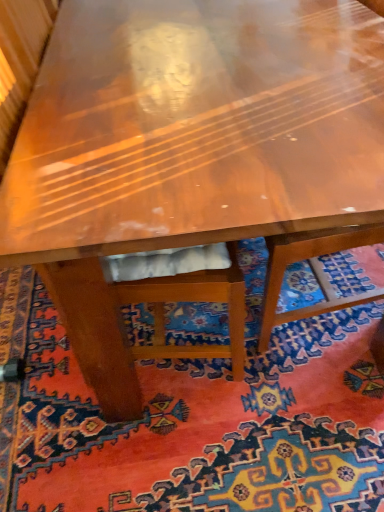
Locate an element on the screen. This screenshot has height=512, width=384. carpet with intricate patterns at center is located at coordinates (195, 417).

What is the approximate height of carpet with intricate patterns at center?

The height of carpet with intricate patterns at center is 1.87 inches.

This screenshot has width=384, height=512. What do you see at coordinates (195, 417) in the screenshot?
I see `carpet with intricate patterns at center` at bounding box center [195, 417].

Locate an element on the screen. carpet with intricate patterns at center is located at coordinates (195, 417).